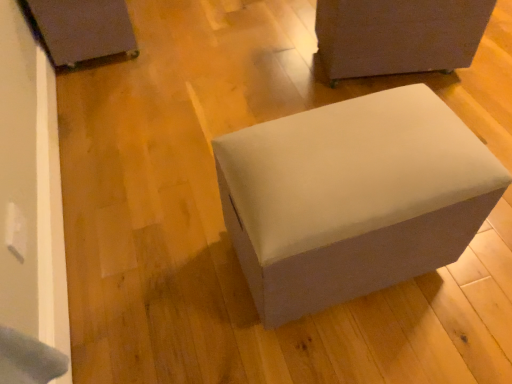
Question: Is matte black box at upper left, acting as the third furniture starting from the right, oriented towards matte gray ottoman at upper right, arranged as the 3th furniture when viewed from the left?

Choices:
 (A) yes
 (B) no

Answer: (A)

Question: Is matte black box at upper left, the first furniture in the left-to-right sequence, touching matte gray ottoman at upper right, arranged as the 3th furniture when viewed from the left?

Choices:
 (A) no
 (B) yes

Answer: (A)

Question: From the image's perspective, would you say matte black box at upper left, the first furniture in the left-to-right sequence, is shown under matte gray ottoman at upper right, the 1th furniture in the right-to-left sequence?

Choices:
 (A) yes
 (B) no

Answer: (B)

Question: Considering the relative sizes of matte black box at upper left, the first furniture in the left-to-right sequence, and matte gray ottoman at upper right, arranged as the 3th furniture when viewed from the left, in the image provided, is matte black box at upper left, the first furniture in the left-to-right sequence, shorter than matte gray ottoman at upper right, arranged as the 3th furniture when viewed from the left,?

Choices:
 (A) no
 (B) yes

Answer: (B)

Question: Considering the relative sizes of matte black box at upper left, acting as the third furniture starting from the right, and matte gray ottoman at upper right, the 1th furniture in the right-to-left sequence, in the image provided, is matte black box at upper left, acting as the third furniture starting from the right, thinner than matte gray ottoman at upper right, the 1th furniture in the right-to-left sequence,?

Choices:
 (A) yes
 (B) no

Answer: (B)

Question: Does point (441, 178) appear closer or farther from the camera than point (425, 54)?

Choices:
 (A) closer
 (B) farther

Answer: (A)

Question: From the image's perspective, relative to matte gray ottoman at upper right, the 1th furniture in the right-to-left sequence, is suede-like gray ottoman at center, which appears as the 2th furniture when viewed from the left, above or below?

Choices:
 (A) above
 (B) below

Answer: (B)

Question: Do you think suede-like gray ottoman at center, placed as the 2th furniture when sorted from right to left, is within matte gray ottoman at upper right, the 1th furniture in the right-to-left sequence, or outside of it?

Choices:
 (A) inside
 (B) outside

Answer: (B)

Question: In the image, is suede-like gray ottoman at center, which appears as the 2th furniture when viewed from the left, positioned in front of or behind matte gray ottoman at upper right, arranged as the 3th furniture when viewed from the left?

Choices:
 (A) behind
 (B) front

Answer: (B)

Question: Looking at their shapes, would you say matte gray ottoman at upper right, the 1th furniture in the right-to-left sequence, is wider or thinner than matte black box at upper left, the first furniture in the left-to-right sequence?

Choices:
 (A) wide
 (B) thin

Answer: (B)

Question: Does point (388, 23) appear closer or farther from the camera than point (92, 36)?

Choices:
 (A) farther
 (B) closer

Answer: (B)

Question: Considering the relative positions of matte gray ottoman at upper right, the 1th furniture in the right-to-left sequence, and matte black box at upper left, the first furniture in the left-to-right sequence, in the image provided, is matte gray ottoman at upper right, the 1th furniture in the right-to-left sequence, to the left or to the right of matte black box at upper left, the first furniture in the left-to-right sequence,?

Choices:
 (A) left
 (B) right

Answer: (B)

Question: From a real-world perspective, is matte gray ottoman at upper right, arranged as the 3th furniture when viewed from the left, above or below matte black box at upper left, acting as the third furniture starting from the right?

Choices:
 (A) above
 (B) below

Answer: (A)

Question: Considering the positions of suede-like gray ottoman at center, which appears as the 2th furniture when viewed from the left, and matte black box at upper left, acting as the third furniture starting from the right, in the image, is suede-like gray ottoman at center, which appears as the 2th furniture when viewed from the left, taller or shorter than matte black box at upper left, acting as the third furniture starting from the right,?

Choices:
 (A) short
 (B) tall

Answer: (B)

Question: Based on their positions, is suede-like gray ottoman at center, which appears as the 2th furniture when viewed from the left, located to the left or right of matte black box at upper left, acting as the third furniture starting from the right?

Choices:
 (A) left
 (B) right

Answer: (B)